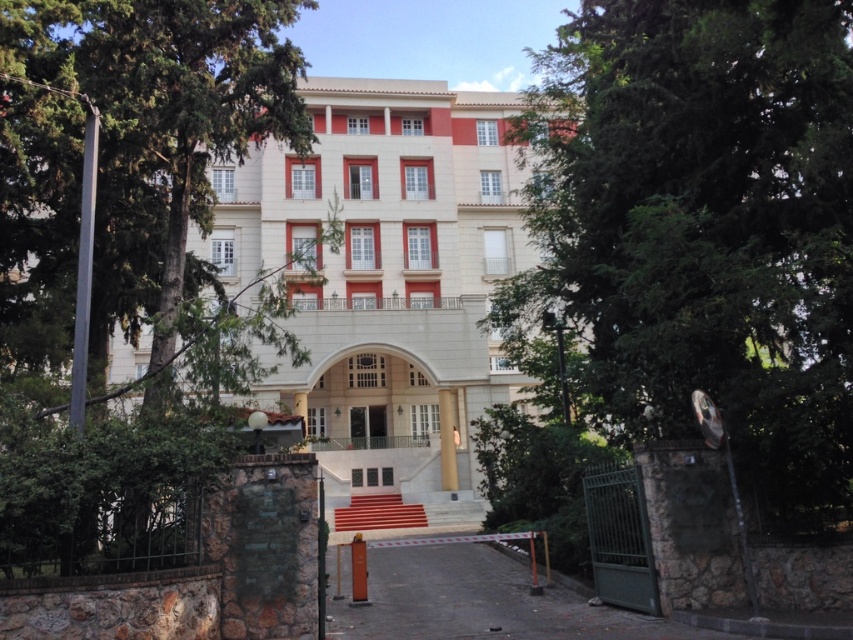
You are standing in front of the beige stone building at center and want to walk towards the green leafy tree at left. Which direction should you face to move closer to the tree?

You should face towards the left side to move closer to the green leafy tree at left since it is positioned to the left of the beige stone building at center.

From the picture: You are standing at the point marked by the coordinates point (131,262) in the image. Looking towards the building, which direction should you walk to reach the entrance?

The point (131,262) marks the green leafy tree at left. Since the entrance is at the center of the building, you should walk towards the right to face the building and then proceed forward to reach the entrance.

You are standing at the base of the red carpeted stairs leading to the entrance of the classical building. You want to take a photo of the green leafy tree at center from exactly 30 feet away. Can you do this while staying on the stairs?

The green leafy tree at center and camera are 28.99 feet apart from each other. Since you need to be 30 feet away, you cannot take the photo while staying on the stairs as the distance is slightly less than required.